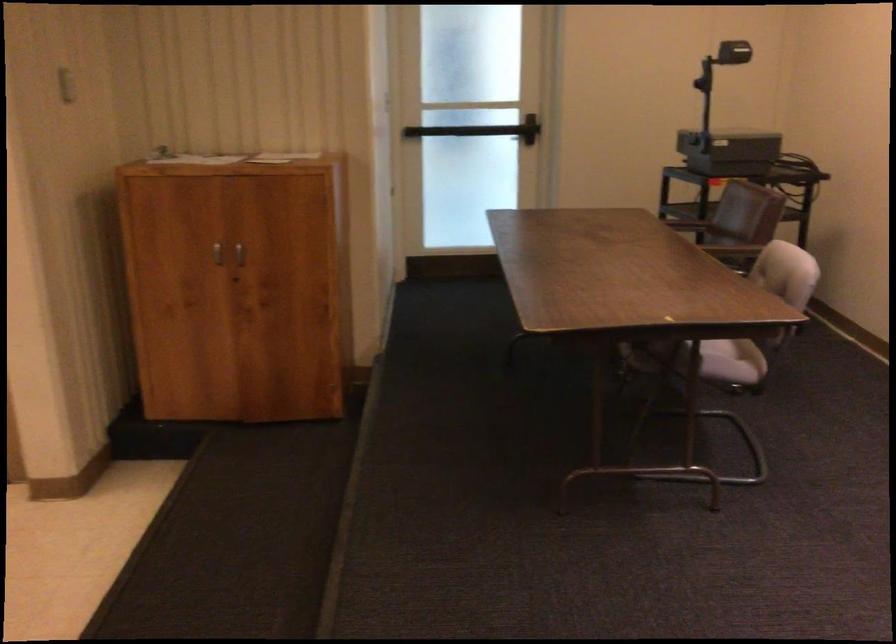
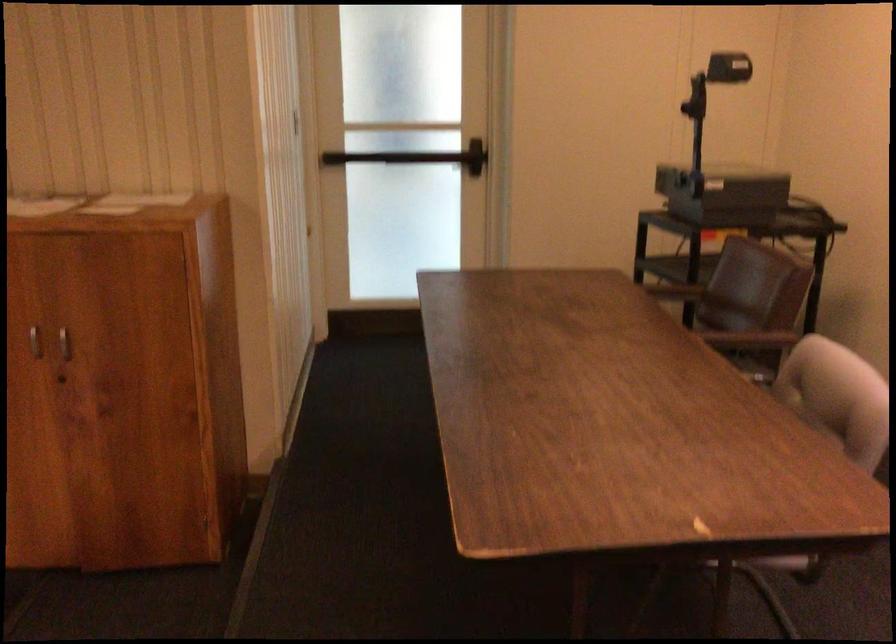
Question: The camera is either moving clockwise (left) or counter-clockwise (right) around the object. The first image is from the beginning of the video and the second image is from the end. Is the camera moving left or right when shooting the video?

Choices:
 (A) Left
 (B) Right

Answer: (A)